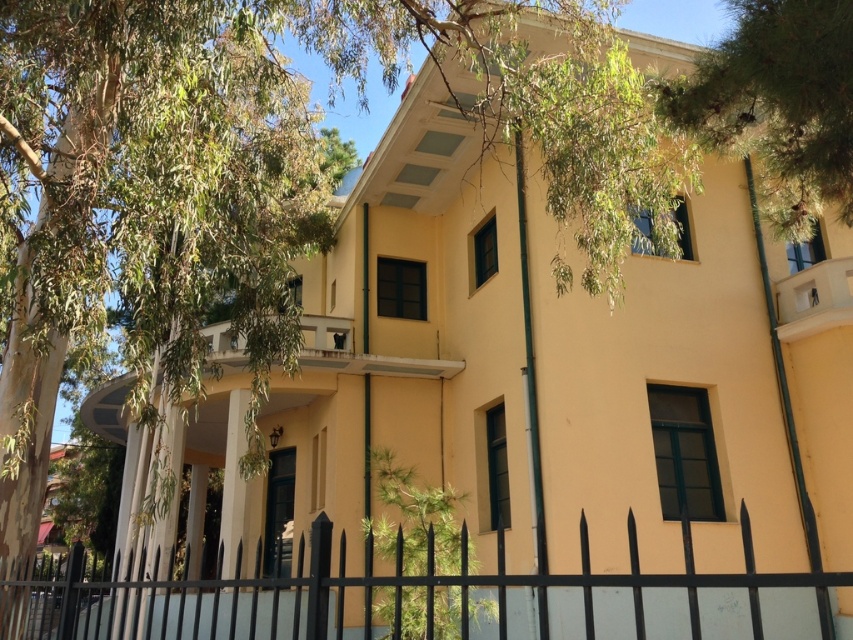
Question: Which object is positioned farthest from the green leafy tree at upper left?

Choices:
 (A) black metal fence at lower center
 (B) green leafy tree at upper right

Answer: (B)

Question: Estimate the real-world distances between objects in this image. Which object is closer to the green leafy tree at upper right?

Choices:
 (A) green leafy tree at upper left
 (B) black metal fence at lower center

Answer: (B)

Question: Does black metal fence at lower center appear on the right side of green leafy tree at upper right?

Choices:
 (A) yes
 (B) no

Answer: (B)

Question: Can you confirm if green leafy tree at upper left is bigger than green leafy tree at upper right?

Choices:
 (A) yes
 (B) no

Answer: (B)

Question: Which point is farther to the camera?

Choices:
 (A) green leafy tree at upper left
 (B) green leafy tree at upper right
 (C) black metal fence at lower center

Answer: (A)

Question: Can you confirm if black metal fence at lower center is wider than green leafy tree at upper right?

Choices:
 (A) no
 (B) yes

Answer: (B)